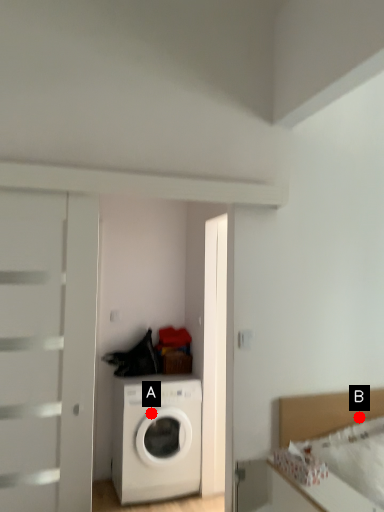
Question: Two points are circled on the image, labeled by A and B beside each circle. Which point is farther to the camera?

Choices:
 (A) A is further
 (B) B is further

Answer: (A)